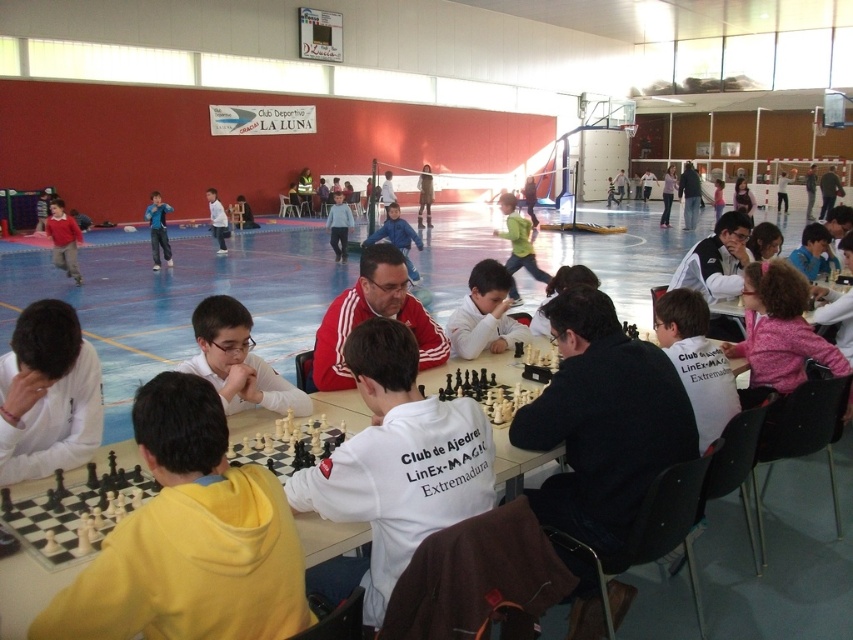
Question: Which of the following is the farthest from the observer?

Choices:
 (A) (700, 278)
 (B) (474, 272)

Answer: (A)

Question: Considering the real-world distances, which object is closest to the blue denim jeans at center?

Choices:
 (A) matte white shirt at center
 (B) white cotton shirt at center

Answer: (B)

Question: In this image, where is white fleece jacket at center located relative to white jacket at center?

Choices:
 (A) below
 (B) above

Answer: (A)

Question: Can you confirm if red smooth jacket at center is bigger than matte white shirt at center?

Choices:
 (A) yes
 (B) no

Answer: (A)

Question: Considering the real-world distances, which object is closest to the black sweater at center?

Choices:
 (A) yellow fleece at center
 (B) matte white shirt at center
 (C) white shirt at center

Answer: (B)

Question: Considering the relative positions of white jacket at center and blue fabric shirt at center in the image provided, where is white jacket at center located with respect to blue fabric shirt at center?

Choices:
 (A) above
 (B) below

Answer: (B)